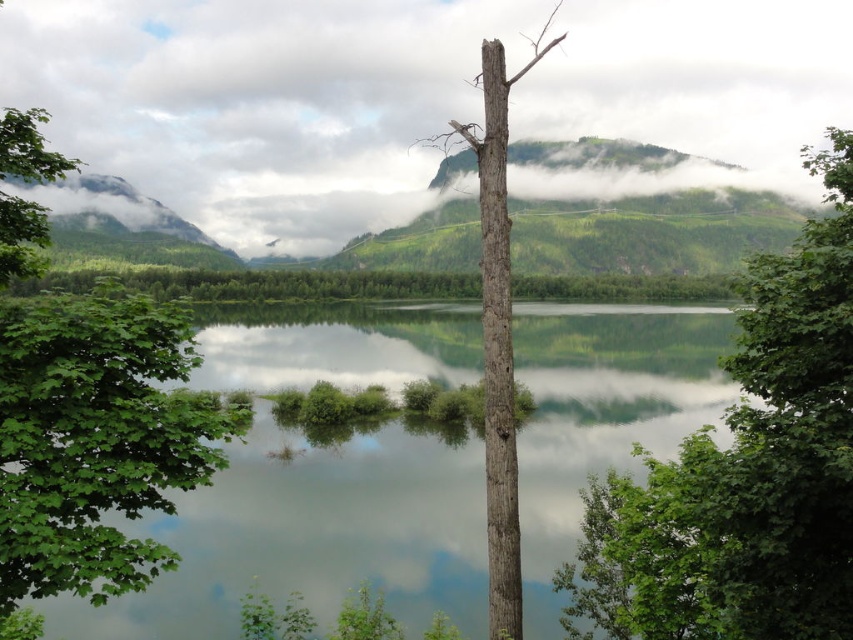
In the scene shown: You are standing at the center of the image and want to locate the green matte tree at upper right. Based on its coordinates, in which cardinal direction relative to the center would you find it?

The green matte tree at upper right is located at coordinates point [746,470], which places it in the northeast direction relative to the center of the image.

You are an artist trying to sketch this landscape. You want to ensure the green matte tree at upper right and the green forested mountain at upper left are placed correctly in your drawing. Based on the scene, which object should be drawn higher up on the paper?

The green forested mountain at upper left should be drawn higher up on the paper because the green matte tree at upper right is positioned under it.